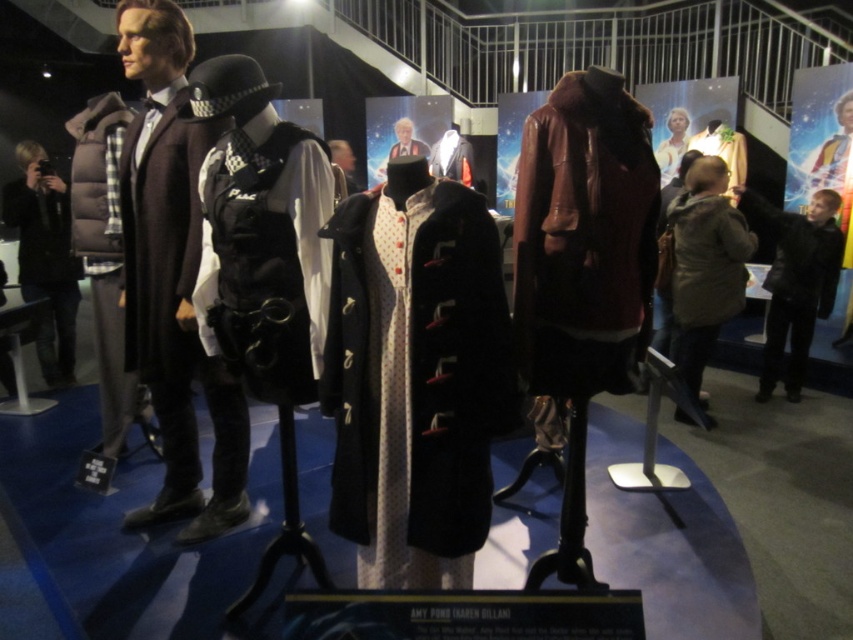
Question: Can you confirm if matte black puffer jacket at left is thinner than velvet burgundy coat at center?

Choices:
 (A) yes
 (B) no

Answer: (B)

Question: Which of the following is the closest to the observer?

Choices:
 (A) (421, 292)
 (B) (701, 148)
 (C) (299, 291)
 (D) (82, 244)

Answer: (A)

Question: Does velvet black coat at center have a larger size compared to matte black uniform at center?

Choices:
 (A) no
 (B) yes

Answer: (A)

Question: Which point is farther to the camera?

Choices:
 (A) velvet burgundy coat at center
 (B) light yellow fabric coat at center

Answer: (B)

Question: Which point is closer to the camera?

Choices:
 (A) (676, 273)
 (B) (471, 182)

Answer: (A)

Question: Is brown fuzzy coat at center thinner than light yellow fabric coat at center?

Choices:
 (A) yes
 (B) no

Answer: (A)